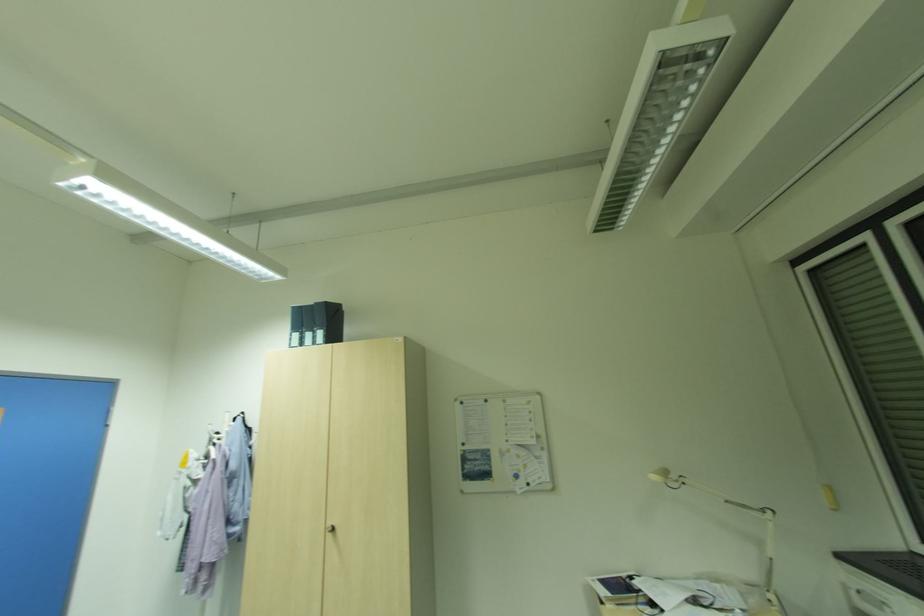
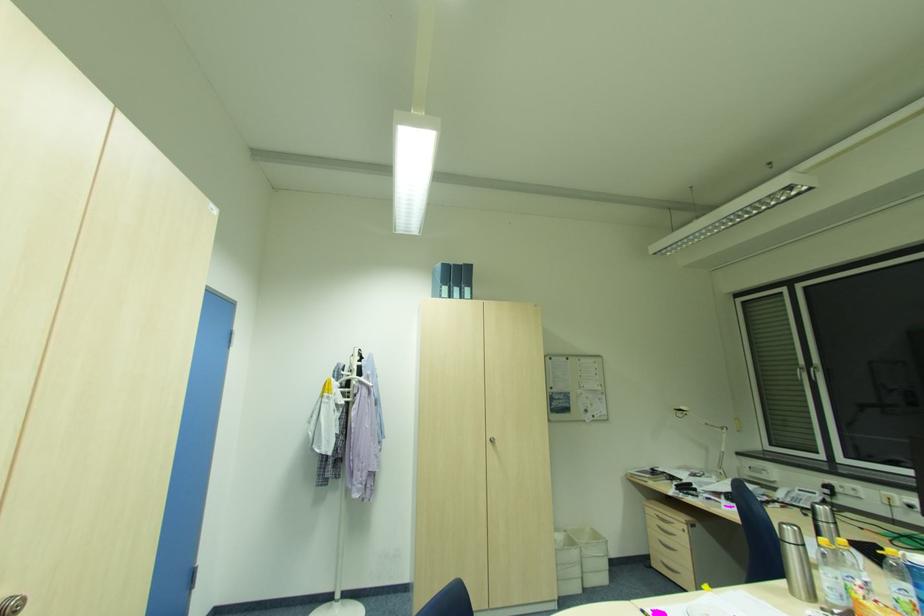
Question: Which direction would the cameraman need to move to produce the second image? Reply with the corresponding letter.

Choices:
 (A) Left
 (B) Right
 (C) Forward
 (D) Backward

Answer: (A)